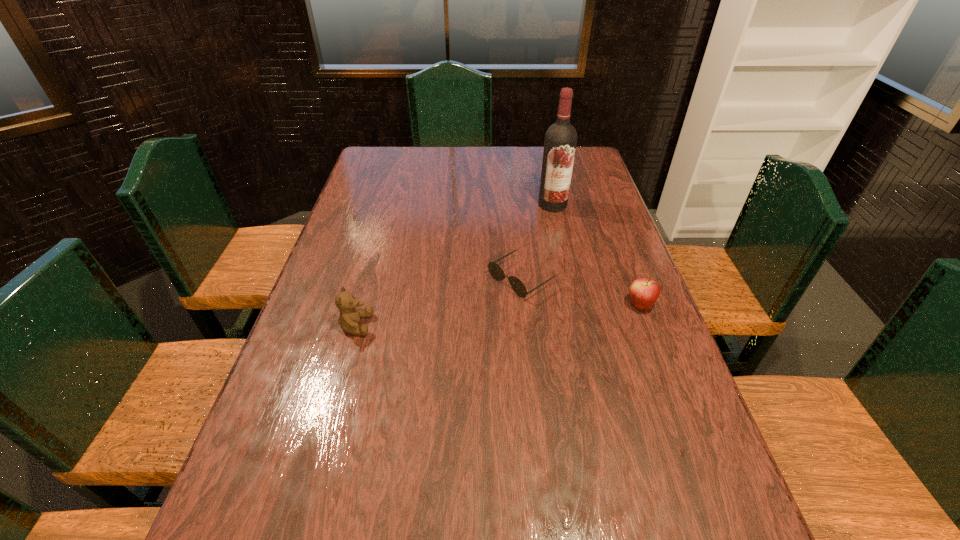
At what (x,y) coordinates should I click in order to perform the action: click on vacant space in between the teddy bear and the apple. Please return your answer as a coordinate pair (x, y). The image size is (960, 540). Looking at the image, I should click on (498, 315).

The height and width of the screenshot is (540, 960). Identify the location of unoccupied position between the wine bottle and the shortest object. (537, 241).

Locate an element on the screen. free space that is in between the sunglasses and the farthest object is located at coordinates (537, 241).

Locate an element on the screen. blank region between the wine bottle and the leftmost object is located at coordinates (454, 265).

At what (x,y) coordinates should I click in order to perform the action: click on vacant point located between the tallest object and the shortest object. Please return your answer as a coordinate pair (x, y). The image size is (960, 540). Looking at the image, I should click on (537, 241).

Find the location of a particular element. vacant point located between the apple and the sunglasses is located at coordinates (581, 292).

Where is `free space between the rightmost object and the shortest object`? free space between the rightmost object and the shortest object is located at coordinates coord(581,292).

Identify the location of vacant point located between the teddy bear and the apple. (498, 315).

Where is `empty space that is in between the tallest object and the leftmost object`? Image resolution: width=960 pixels, height=540 pixels. empty space that is in between the tallest object and the leftmost object is located at coordinates (454, 265).

Where is `empty space between the sunglasses and the rightmost object`? This screenshot has width=960, height=540. empty space between the sunglasses and the rightmost object is located at coordinates click(x=581, y=292).